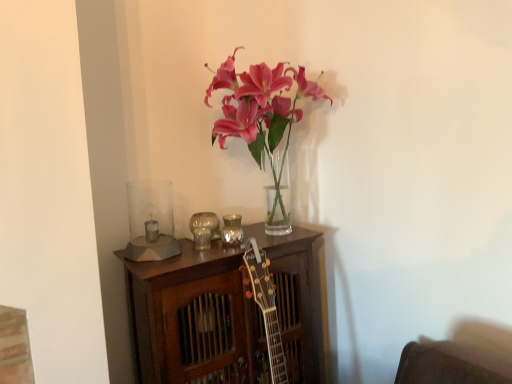
Question: Is clear glass candle holder at left, acting as the third candle holder starting from the right, placed right next to metallic silver candle holder at center, acting as the second candle holder starting from the right?

Choices:
 (A) yes
 (B) no

Answer: (B)

Question: From a real-world perspective, is clear glass candle holder at left, acting as the third candle holder starting from the right, positioned under metallic silver candle holder at center, acting as the second candle holder starting from the right, based on gravity?

Choices:
 (A) yes
 (B) no

Answer: (B)

Question: Would you say clear glass candle holder at left, acting as the third candle holder starting from the right, is outside metallic silver candle holder at center, the 2th candle holder viewed from the left?

Choices:
 (A) no
 (B) yes

Answer: (B)

Question: Considering the relative sizes of clear glass candle holder at left, positioned as the 1th candle holder in left-to-right order, and metallic silver candle holder at center, acting as the second candle holder starting from the right, in the image provided, is clear glass candle holder at left, positioned as the 1th candle holder in left-to-right order, wider than metallic silver candle holder at center, acting as the second candle holder starting from the right,?

Choices:
 (A) no
 (B) yes

Answer: (B)

Question: Can you confirm if clear glass candle holder at left, positioned as the 1th candle holder in left-to-right order, is bigger than metallic silver candle holder at center, acting as the second candle holder starting from the right?

Choices:
 (A) yes
 (B) no

Answer: (A)

Question: Is point (160, 218) positioned closer to the camera than point (225, 243)?

Choices:
 (A) closer
 (B) farther

Answer: (B)

Question: Relative to metallic reflective candle holder at center, acting as the first candle holder starting from the right, is clear glass candle holder at left, acting as the third candle holder starting from the right, in front or behind?

Choices:
 (A) front
 (B) behind

Answer: (A)

Question: From their relative heights in the image, would you say clear glass candle holder at left, positioned as the 1th candle holder in left-to-right order, is taller or shorter than metallic reflective candle holder at center, which ranks as the 3th candle holder in left-to-right order?

Choices:
 (A) short
 (B) tall

Answer: (B)

Question: Would you say clear glass candle holder at left, acting as the third candle holder starting from the right, is inside or outside metallic reflective candle holder at center, acting as the first candle holder starting from the right?

Choices:
 (A) outside
 (B) inside

Answer: (A)

Question: Considering the positions of metallic silver candle holder at center, acting as the second candle holder starting from the right, and clear glass candle holder at left, acting as the third candle holder starting from the right, in the image, is metallic silver candle holder at center, acting as the second candle holder starting from the right, wider or thinner than clear glass candle holder at left, acting as the third candle holder starting from the right,?

Choices:
 (A) thin
 (B) wide

Answer: (A)

Question: Is metallic silver candle holder at center, the 2th candle holder viewed from the left, taller or shorter than clear glass candle holder at left, acting as the third candle holder starting from the right?

Choices:
 (A) short
 (B) tall

Answer: (A)

Question: In the image, is metallic silver candle holder at center, the 2th candle holder viewed from the left, positioned in front of or behind clear glass candle holder at left, positioned as the 1th candle holder in left-to-right order?

Choices:
 (A) front
 (B) behind

Answer: (B)

Question: Does point (197, 226) appear closer or farther from the camera than point (163, 203)?

Choices:
 (A) closer
 (B) farther

Answer: (A)

Question: From the image's perspective, relative to metallic silver candle holder at center, acting as the second candle holder starting from the right, is metallic reflective candle holder at center, which ranks as the 3th candle holder in left-to-right order, above or below?

Choices:
 (A) below
 (B) above

Answer: (B)

Question: Is metallic reflective candle holder at center, acting as the first candle holder starting from the right, to the left or to the right of metallic silver candle holder at center, the 2th candle holder viewed from the left, in the image?

Choices:
 (A) left
 (B) right

Answer: (B)